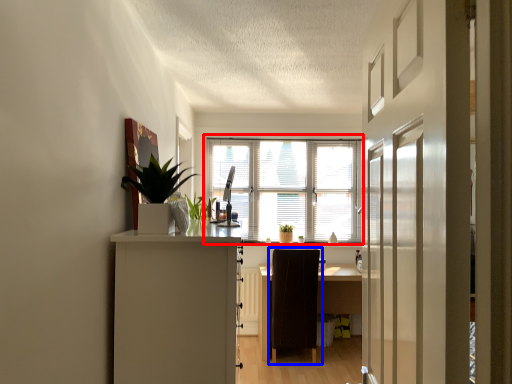
Question: Which object is further to the camera taking this photo, window (highlighted by a red box) or chair (highlighted by a blue box)?

Choices:
 (A) window
 (B) chair

Answer: (A)